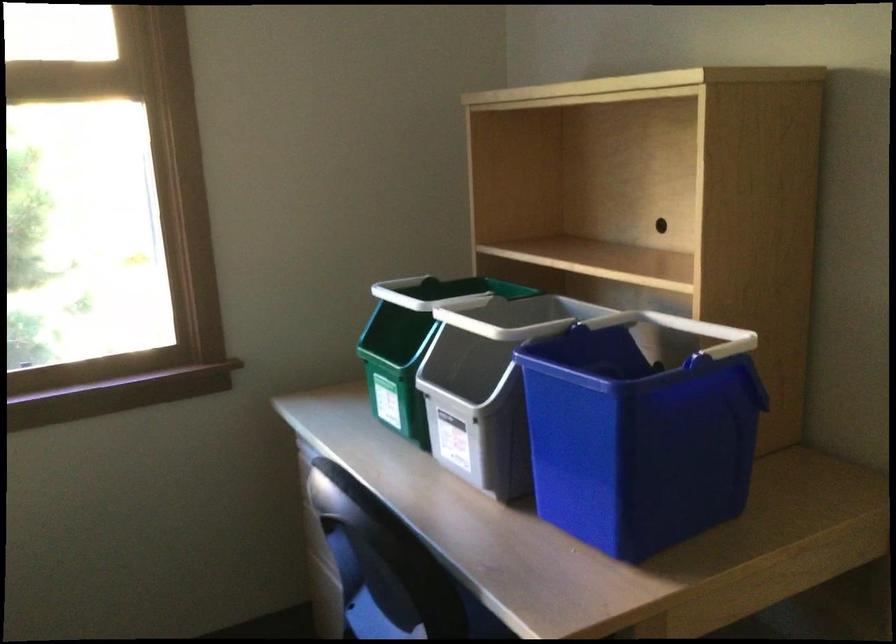
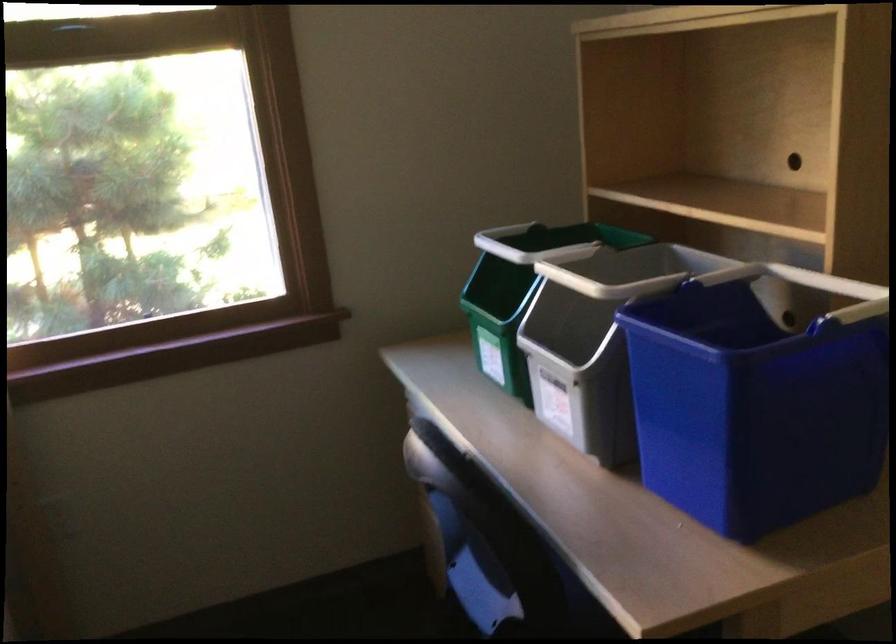
Question: The first image is from the beginning of the video and the second image is from the end. How did the camera likely rotate when shooting the video?

Choices:
 (A) Left
 (B) Right
 (C) Up
 (D) Down

Answer: (A)